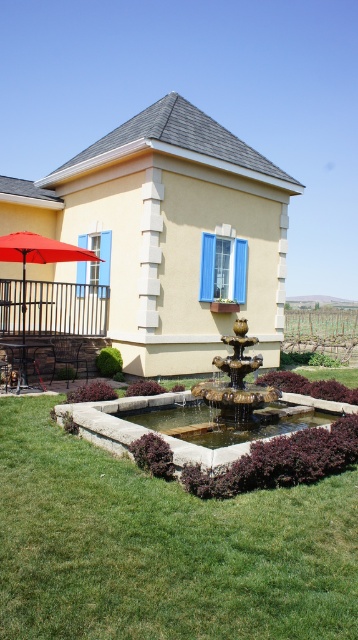
Is point (64, 595) positioned behind point (207, 440)?

No, (64, 595) is in front of (207, 440).

Does green grass at lower center appear over clear stone fountain at center?

Incorrect, green grass at lower center is not positioned above clear stone fountain at center.

This screenshot has height=640, width=358. Describe the element at coordinates (162, 547) in the screenshot. I see `green grass at lower center` at that location.

This screenshot has height=640, width=358. What are the coordinates of `green grass at lower center` in the screenshot? It's located at (162, 547).

What do you see at coordinates (162, 547) in the screenshot? The image size is (358, 640). I see `green grass at lower center` at bounding box center [162, 547].

Is green grass at lower center taller than gold metallic fountain at center?

No, green grass at lower center is not taller than gold metallic fountain at center.

Who is more distant from viewer, (12, 403) or (223, 388)?

Point (12, 403)

Find the location of a particular element. green grass at lower center is located at coordinates (162, 547).

Is clear stone fountain at center bigger than gold metallic fountain at center?

Incorrect, clear stone fountain at center is not larger than gold metallic fountain at center.

Does clear stone fountain at center have a smaller size compared to gold metallic fountain at center?

Correct, clear stone fountain at center occupies less space than gold metallic fountain at center.

Which is in front, point (195, 412) or point (244, 321)?

Point (244, 321) is more forward.

Locate an element on the screen. Image resolution: width=358 pixels, height=640 pixels. clear stone fountain at center is located at coordinates (220, 426).